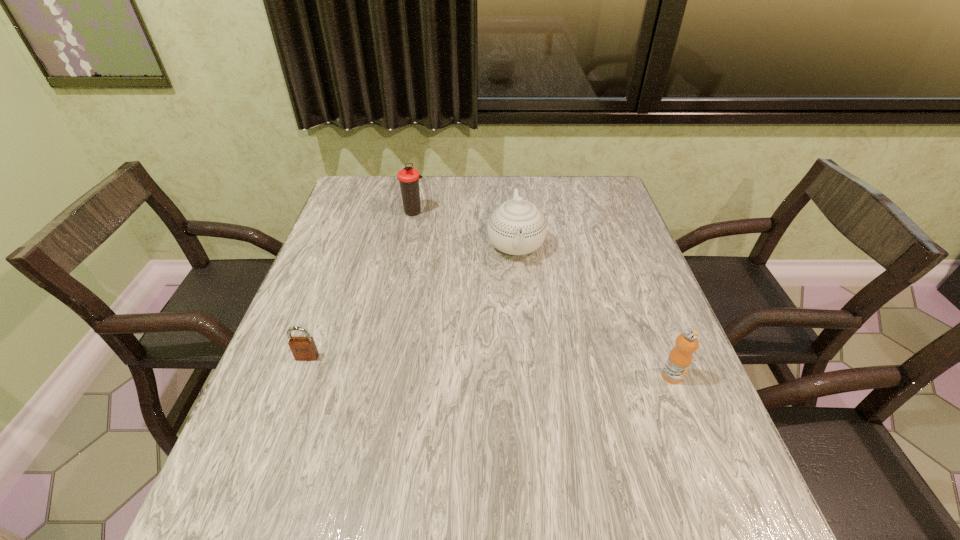
Locate which object ranks third in proximity to the chinaware. Please provide its 2D coordinates. Your answer should be formatted as a tuple, i.e. [(x, y)], where the tuple contains the x and y coordinates of a point satisfying the conditions above.

[(303, 348)]

You are a GUI agent. You are given a task and a screenshot of the screen. Output one action in this format:
    pyautogui.click(x=<x>, y=<y>)
    Task: Click on the second closest object relative to the rightmost object
    The width and height of the screenshot is (960, 540).
    Given the screenshot: What is the action you would take?
    pyautogui.click(x=303, y=348)